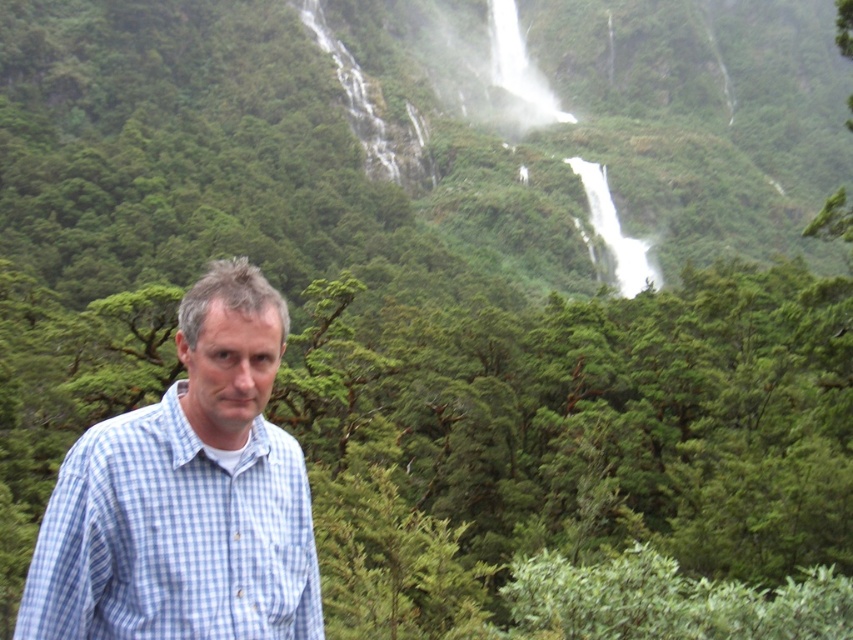
Question: Among these objects, which one is nearest to the camera?

Choices:
 (A) blue checkered shirt at center
 (B) white frothy water at upper center

Answer: (A)

Question: Can you confirm if blue checkered shirt at center is positioned to the right of white frothy water at upper center?

Choices:
 (A) no
 (B) yes

Answer: (A)

Question: Is blue checkered shirt at center bigger than white frothy water at upper center?

Choices:
 (A) yes
 (B) no

Answer: (A)

Question: Which point is farther to the camera?

Choices:
 (A) white frothy water at upper center
 (B) blue checkered shirt at center

Answer: (A)

Question: Is blue checkered shirt at center thinner than white frothy water at upper center?

Choices:
 (A) no
 (B) yes

Answer: (A)